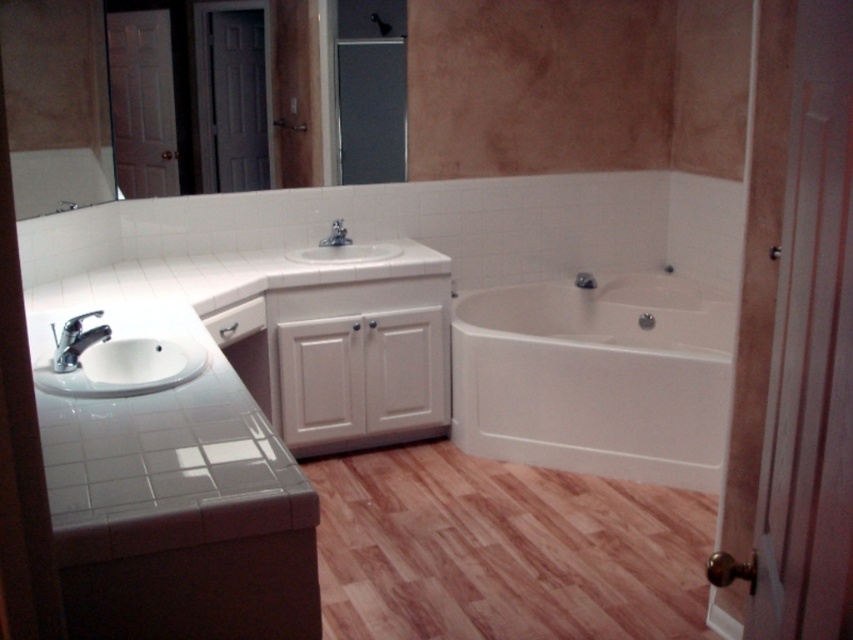
In the bathroom scene described, there is a point labeled at coordinates (596, 378). Which object from the list of objects corresponds to this point? The objects are the double sink vanity with dark gray countertop on the left and the white glossy bathtub at center.

The point at coordinates (596, 378) corresponds to the white glossy bathtub at center.

Based on the photo, you are a plumber inspecting the bathroom layout. You notice the white glossy bathtub at center and the white glossy sink at center. According to the plumbing codes, the sink must be above the bathtub to ensure proper drainage. Is the current arrangement compliant with the code?

The white glossy bathtub at center is positioned under the white glossy sink at center, so the current arrangement is compliant with the plumbing codes as the sink is above the bathtub for proper drainage.

You are a plumber trying to install a new matte silver faucet at center in a modern bathroom. The current white glossy bathtub at center is in the way. Can you move the bathtub to the right to make space for the faucet installation?

The white glossy bathtub at center might be wider than the matte silver faucet at center, so it might be difficult to move the bathtub to the right without checking the exact dimensions. You should measure both objects to ensure there is enough space.